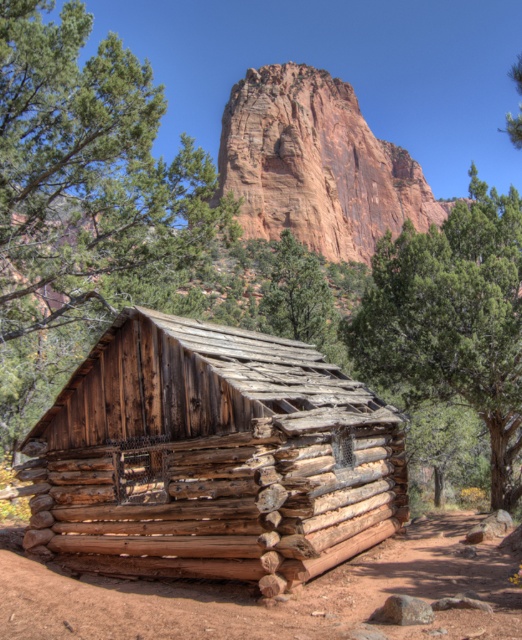
Question: Which object is farther from the camera taking this photo?

Choices:
 (A) green rough bark tree at center
 (B) weathered wood cabin at center
 (C) rustic stone mountain at center

Answer: (C)

Question: Can you confirm if weathered wood cabin at center is positioned below green leafy tree at center?

Choices:
 (A) yes
 (B) no

Answer: (B)

Question: Considering the relative positions of weathered wood cabin at center and green leafy tree at center in the image provided, where is weathered wood cabin at center located with respect to green leafy tree at center?

Choices:
 (A) left
 (B) right

Answer: (A)

Question: Among these points, which one is nearest to the camera?

Choices:
 (A) (x=124, y=524)
 (B) (x=30, y=36)
 (C) (x=290, y=177)

Answer: (A)

Question: Does weathered wood cabin at center have a greater width compared to green rough bark tree at center?

Choices:
 (A) no
 (B) yes

Answer: (B)

Question: Which object appears farthest from the camera in this image?

Choices:
 (A) green leafy tree at center
 (B) weathered wood cabin at center
 (C) green rough bark tree at center

Answer: (C)